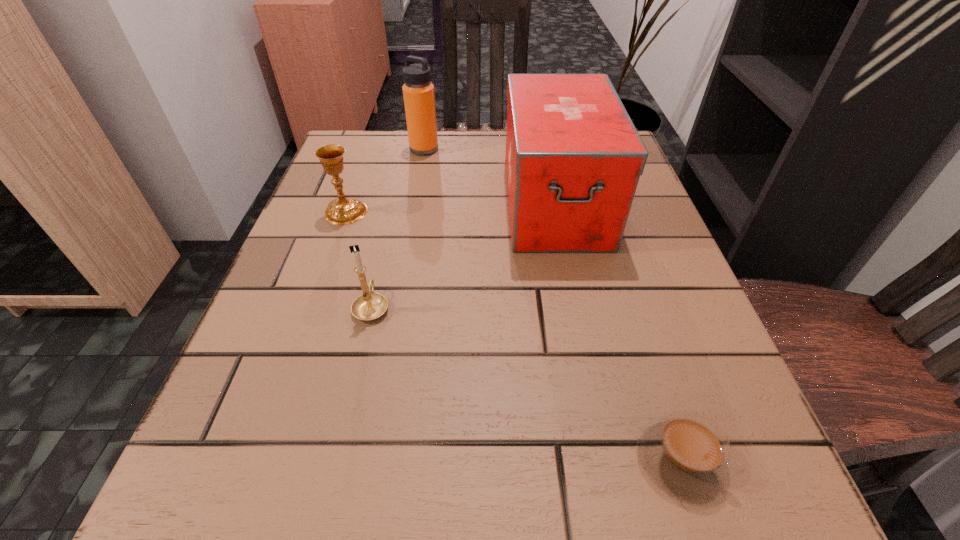
Where is `object that is positioned at the far right corner`? The width and height of the screenshot is (960, 540). object that is positioned at the far right corner is located at coordinates (573, 159).

In order to click on object positioned at the near right corner in this screenshot , I will do `click(685, 454)`.

Image resolution: width=960 pixels, height=540 pixels. I want to click on vacant space at the left edge of the desktop, so click(x=384, y=204).

The image size is (960, 540). In the image, there is a desktop. What are the coordinates of `vacant space at the right edge` in the screenshot? It's located at (672, 273).

In the image, there is a desktop. In order to click on free space at the far left corner in this screenshot , I will do `click(382, 131)`.

Identify the location of free area in between the first-aid kit and the fourth farthest object. Image resolution: width=960 pixels, height=540 pixels. (464, 255).

The image size is (960, 540). I want to click on free area in between the cappuccino and the candle holder, so click(526, 383).

This screenshot has width=960, height=540. I want to click on vacant area between the nearest object and the thermos bottle, so click(x=552, y=305).

Where is `unoccupied position between the first-aid kit and the leftmost object`? This screenshot has width=960, height=540. unoccupied position between the first-aid kit and the leftmost object is located at coordinates (450, 207).

At what (x,y) coordinates should I click in order to perform the action: click on free spot between the first-aid kit and the cappuccino. Please return your answer as a coordinate pair (x, y). This screenshot has height=540, width=960. Looking at the image, I should click on point(618,332).